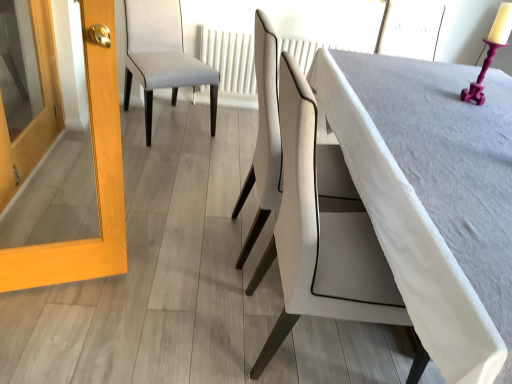
Question: Can you confirm if smooth gray table at center is bigger than white textured radiator at center?

Choices:
 (A) yes
 (B) no

Answer: (A)

Question: Does smooth gray table at center have a greater height compared to white textured radiator at center?

Choices:
 (A) yes
 (B) no

Answer: (A)

Question: Can you confirm if smooth gray table at center is positioned to the right of white textured radiator at center?

Choices:
 (A) yes
 (B) no

Answer: (A)

Question: Is smooth gray table at center positioned in front of white textured radiator at center?

Choices:
 (A) no
 (B) yes

Answer: (B)

Question: Is smooth gray table at center directly adjacent to white textured radiator at center?

Choices:
 (A) no
 (B) yes

Answer: (A)

Question: Looking at the image, does white leather chair at center, which is the first chair from right to left, seem bigger or smaller compared to white textured radiator at center?

Choices:
 (A) small
 (B) big

Answer: (B)

Question: From their relative heights in the image, would you say white leather chair at center, the 2th chair in the left-to-right sequence, is taller or shorter than white textured radiator at center?

Choices:
 (A) tall
 (B) short

Answer: (A)

Question: Does point (247, 241) appear closer or farther from the camera than point (288, 43)?

Choices:
 (A) closer
 (B) farther

Answer: (A)

Question: Is white leather chair at center, which is the first chair in front-to-back order, to the left or to the right of white textured radiator at center in the image?

Choices:
 (A) right
 (B) left

Answer: (A)

Question: In terms of height, does smooth gray table at center look taller or shorter compared to light wood frame at left?

Choices:
 (A) tall
 (B) short

Answer: (B)

Question: Does point (428, 94) appear closer or farther from the camera than point (123, 210)?

Choices:
 (A) closer
 (B) farther

Answer: (A)

Question: In the image, is smooth gray table at center on the left side or the right side of light wood frame at left?

Choices:
 (A) left
 (B) right

Answer: (B)

Question: Based on their sizes in the image, would you say smooth gray table at center is bigger or smaller than light wood frame at left?

Choices:
 (A) small
 (B) big

Answer: (B)

Question: From the image's perspective, relative to light wood frame at left, is white leather chair at center, which is the first chair in front-to-back order, above or below?

Choices:
 (A) above
 (B) below

Answer: (A)

Question: Is white leather chair at center, which is the first chair from right to left, spatially inside light wood frame at left, or outside of it?

Choices:
 (A) outside
 (B) inside

Answer: (A)